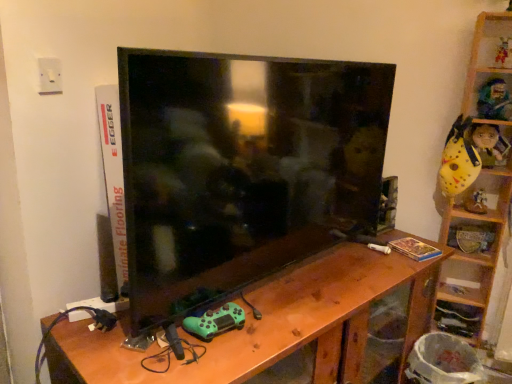
Find the location of a particular element. vacant area situated to the left side of green matte controller at lower center, which is counted as the first toy, starting from the bottom is located at coordinates 132,343.